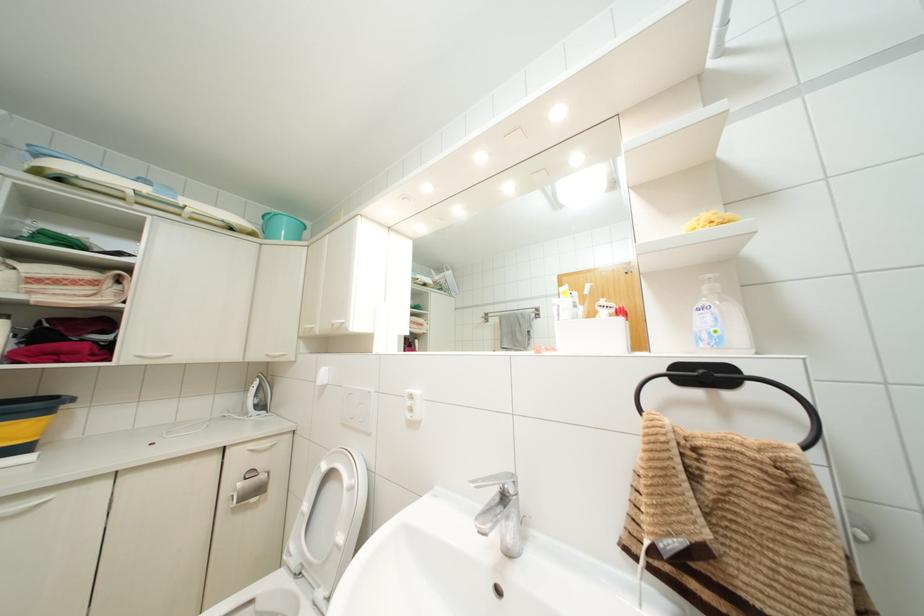
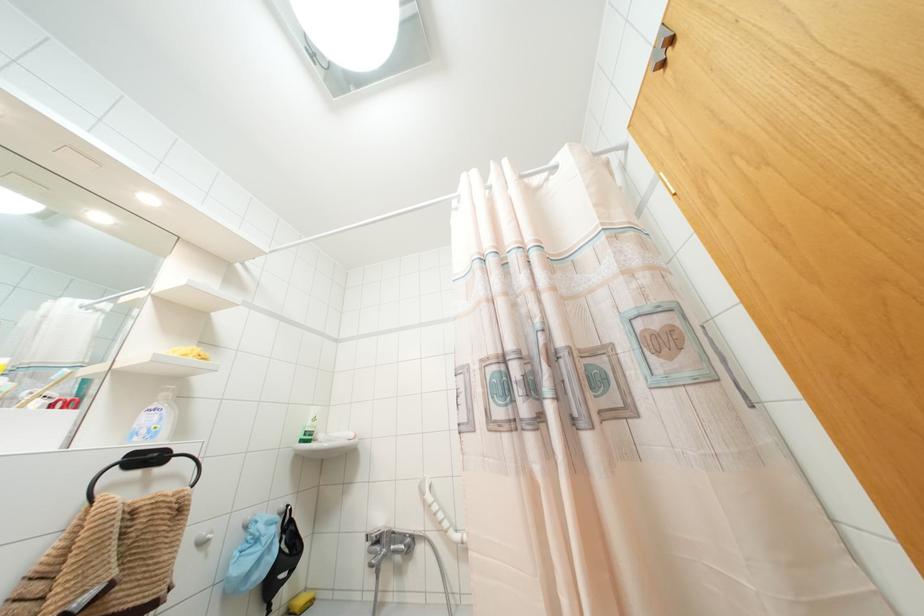
Question: I am providing you with two images of the same scene from different viewpoints. After the viewpoint changes to image2, which objects are now occluded?

Choices:
 (A) white soap dispenser
 (B) shower faucet lever
 (C) yellow sponge
 (D) none of these

Answer: (D)